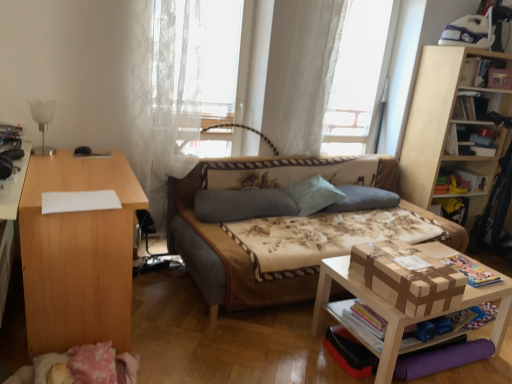
Locate an element on the screen. free space behind white glass lamp at left is located at coordinates (61, 149).